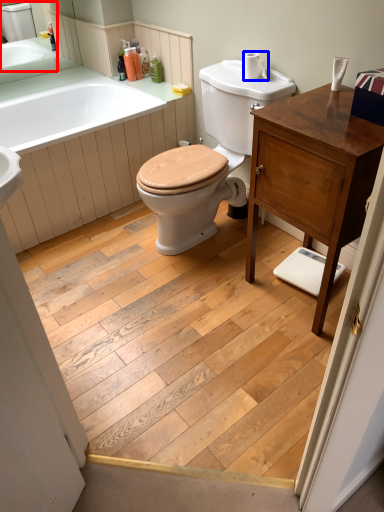
Question: Which object is further to the camera taking this photo, sink (highlighted by a red box) or toilet paper (highlighted by a blue box)?

Choices:
 (A) sink
 (B) toilet paper

Answer: (A)